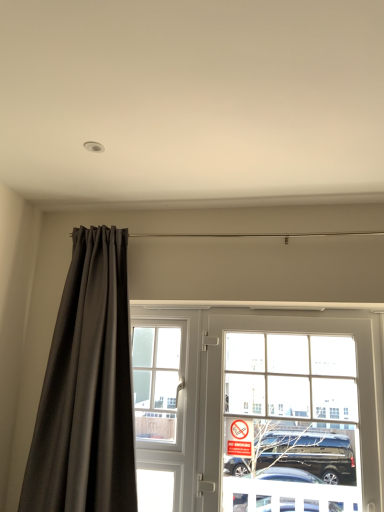
Question: Is clear glass window at center to the left or to the right of red plastic sign at center in the image?

Choices:
 (A) left
 (B) right

Answer: (A)

Question: Looking at their shapes, would you say clear glass window at center is wider or thinner than red plastic sign at center?

Choices:
 (A) wide
 (B) thin

Answer: (A)

Question: Estimate the real-world distances between objects in this image. Which object is closer to the clear glass window at center?

Choices:
 (A) clear glass door at center
 (B) red plastic sign at center
 (C) matte black curtain at left

Answer: (C)

Question: Which object is positioned closest to the red plastic sign at center?

Choices:
 (A) matte black curtain at left
 (B) clear glass window at center
 (C) clear glass door at center

Answer: (C)